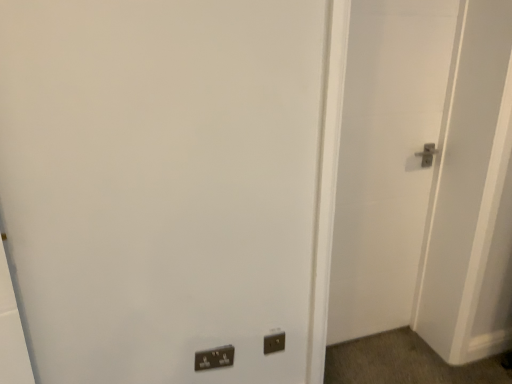
Question: From a real-world perspective, is matte black switch at lower center physically located above or below black plastic electric outlet at lower center?

Choices:
 (A) below
 (B) above

Answer: (A)

Question: Is matte black switch at lower center in front of or behind black plastic electric outlet at lower center in the image?

Choices:
 (A) front
 (B) behind

Answer: (A)

Question: Considering the real-world distances, which object is closest to the black plastic electric outlet at lower center?

Choices:
 (A) matte black switch at lower center
 (B) white matte door at right

Answer: (A)

Question: Which object is positioned farthest from the matte black switch at lower center?

Choices:
 (A) white matte door at right
 (B) black plastic electric outlet at lower center

Answer: (A)